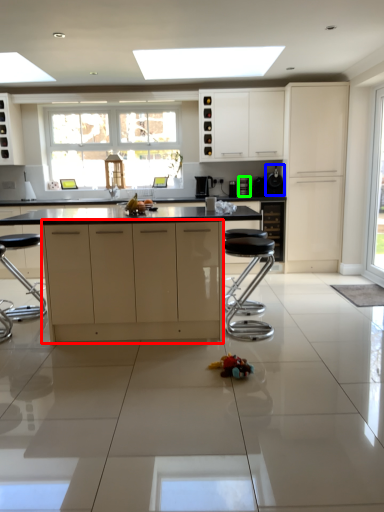
Question: Estimate the real-world distances between objects in this image. Which object is closer to cabinetry (highlighted by a red box), appliance (highlighted by a blue box) or appliance (highlighted by a green box)?

Choices:
 (A) appliance
 (B) appliance

Answer: (B)